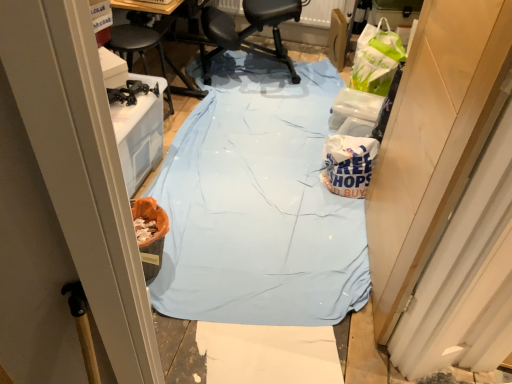
Where is `light blue fabric at center`? The image size is (512, 384). light blue fabric at center is located at coordinates (258, 204).

What do you see at coordinates (433, 141) in the screenshot? I see `wooden door at right` at bounding box center [433, 141].

This screenshot has height=384, width=512. I want to click on white paper bag at center-right, so click(348, 164).

Is the position of wooden door at right less distant than that of white paper bag at center-right?

Yes, the depth of wooden door at right is less than that of white paper bag at center-right.

Is white paper bag at center-right at the back of wooden door at right?

No, white paper bag at center-right is not at the back of wooden door at right.

Considering the points (425, 52) and (326, 162), which point is in front, point (425, 52) or point (326, 162)?

The point (425, 52) is closer.

Which is correct: wooden door at right is inside white paper bag at center-right, or outside of it?

wooden door at right is not inside white paper bag at center-right, it's outside.

From a real-world perspective, is light blue fabric at center physically above white paper bag at center-right?

Actually, light blue fabric at center is physically below white paper bag at center-right in the real world.

Is light blue fabric at center next to white paper bag at center-right and touching it?

No, light blue fabric at center is not next to white paper bag at center-right.

From the image's perspective, which is above, light blue fabric at center or white paper bag at center-right?

From the image's view, light blue fabric at center is above.

Considering the relative sizes of light blue fabric at center and white paper bag at center-right in the image provided, is light blue fabric at center bigger than white paper bag at center-right?

Yes.

From the picture: From a real-world perspective, between white paper bag at center-right and wooden door at right, who is vertically higher?

wooden door at right.

Where is `waste that appears behind the wooden door at right`? waste that appears behind the wooden door at right is located at coordinates (348, 164).

Is white paper bag at center-right completely or partially outside of wooden door at right?

white paper bag at center-right lies outside wooden door at right's area.

Between white paper bag at center-right and wooden door at right, which one has larger width?

white paper bag at center-right is wider.

Where is `tablecloth lying on the left of white paper bag at center-right`? The width and height of the screenshot is (512, 384). tablecloth lying on the left of white paper bag at center-right is located at coordinates (258, 204).

Which is behind, white paper bag at center-right or light blue fabric at center?

Positioned behind is white paper bag at center-right.

Is white paper bag at center-right far from light blue fabric at center?

No, there isn't a large distance between white paper bag at center-right and light blue fabric at center.

How many degrees apart are the facing directions of black leather chair at center and wooden door at right?

black leather chair at center and wooden door at right are facing 108 degrees away from each other.

Is black leather chair at center smaller than wooden door at right?

No.

Are black leather chair at center and wooden door at right beside each other?

No, black leather chair at center is not making contact with wooden door at right.

Does black leather chair at center have a greater height compared to wooden door at right?

No.

Does black leather chair at center contain white paper bag at center-right?

No.

Considering the relative sizes of black leather chair at center and white paper bag at center-right in the image provided, is black leather chair at center bigger than white paper bag at center-right?

Indeed, black leather chair at center has a larger size compared to white paper bag at center-right.

From a real-world perspective, which object stands above the other?

black leather chair at center is physically above.

At what (x,y) coordinates should I click in order to perform the action: click on waste lying on the right of black leather chair at center. Please return your answer as a coordinate pair (x, y). Image resolution: width=512 pixels, height=384 pixels. Looking at the image, I should click on (348, 164).

Is wooden door at right facing away from black leather chair at center?

No, wooden door at right's orientation is not away from black leather chair at center.

From the picture: Is wooden door at right positioned behind black leather chair at center?

No, wooden door at right is closer to the camera.

Considering the relative positions of wooden door at right and black leather chair at center in the image provided, is wooden door at right to the left of black leather chair at center from the viewer's perspective?

No.

Is point (398, 140) positioned behind point (252, 50)?

No, (398, 140) is closer to viewer.

The width and height of the screenshot is (512, 384). Find the location of `waste above the wooden door at right (from the image's perspective)`. waste above the wooden door at right (from the image's perspective) is located at coordinates (348, 164).

The image size is (512, 384). I want to click on waste below the light blue fabric at center (from the image's perspective), so click(348, 164).

Estimate the real-world distances between objects in this image. Which object is further from wooden door at right, light blue fabric at center or black leather chair at center?

black leather chair at center is positioned further to the anchor wooden door at right.

Estimate the real-world distances between objects in this image. Which object is further from white paper bag at center-right, wooden door at right or light blue fabric at center?

wooden door at right lies further to white paper bag at center-right than the other object.

Considering their positions, is black leather chair at center positioned further to white paper bag at center-right than wooden door at right?

The object further to white paper bag at center-right is black leather chair at center.

From the picture: Based on their spatial positions, is light blue fabric at center or wooden door at right closer to white paper bag at center-right?

The object closer to white paper bag at center-right is light blue fabric at center.

When comparing their distances from light blue fabric at center, does black leather chair at center or wooden door at right seem closer?

wooden door at right is closer to light blue fabric at center.

From the image, which object appears to be nearer to light blue fabric at center, wooden door at right or black leather chair at center?

wooden door at right is closer to light blue fabric at center.

Estimate the real-world distances between objects in this image. Which object is further from black leather chair at center, wooden door at right or white paper bag at center-right?

The object further to black leather chair at center is wooden door at right.

Based on their spatial positions, is light blue fabric at center or wooden door at right further from black leather chair at center?

Based on the image, wooden door at right appears to be further to black leather chair at center.

This screenshot has width=512, height=384. I want to click on tablecloth that lies between black leather chair at center and white paper bag at center-right from top to bottom, so click(x=258, y=204).

Locate an element on the screen. This screenshot has height=384, width=512. tablecloth located between wooden door at right and white paper bag at center-right in the depth direction is located at coordinates (258, 204).

In order to click on tablecloth positioned between wooden door at right and black leather chair at center from near to far in this screenshot , I will do `click(258, 204)`.

Image resolution: width=512 pixels, height=384 pixels. Identify the location of waste between wooden door at right and black leather chair at center along the z-axis. (348, 164).